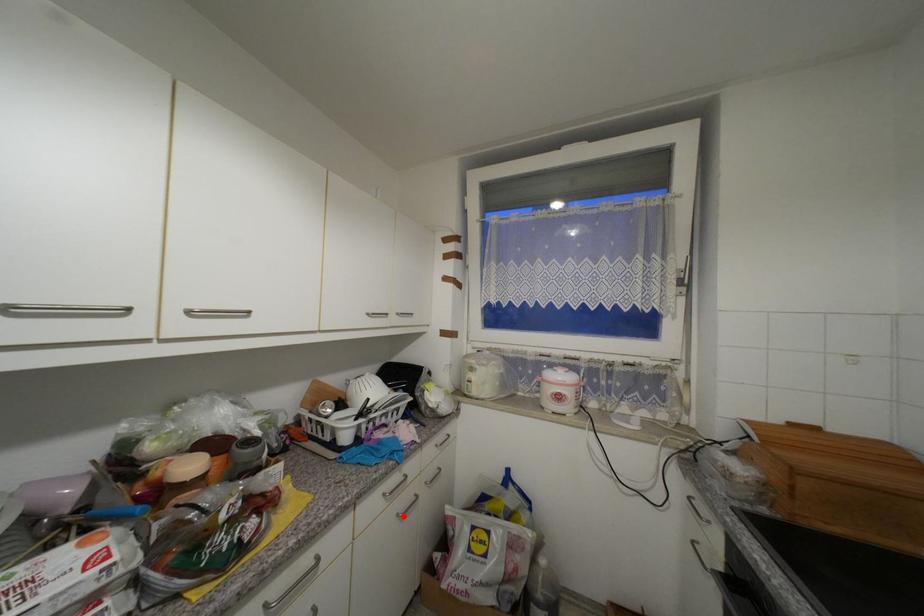
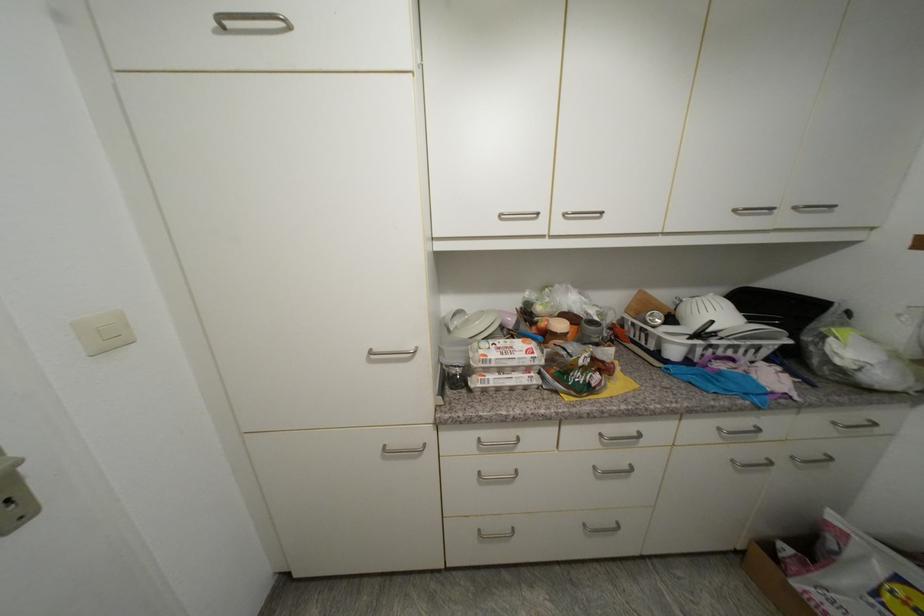
In the second image, find the point that corresponds to the highlighted location in the first image.

(738, 463)